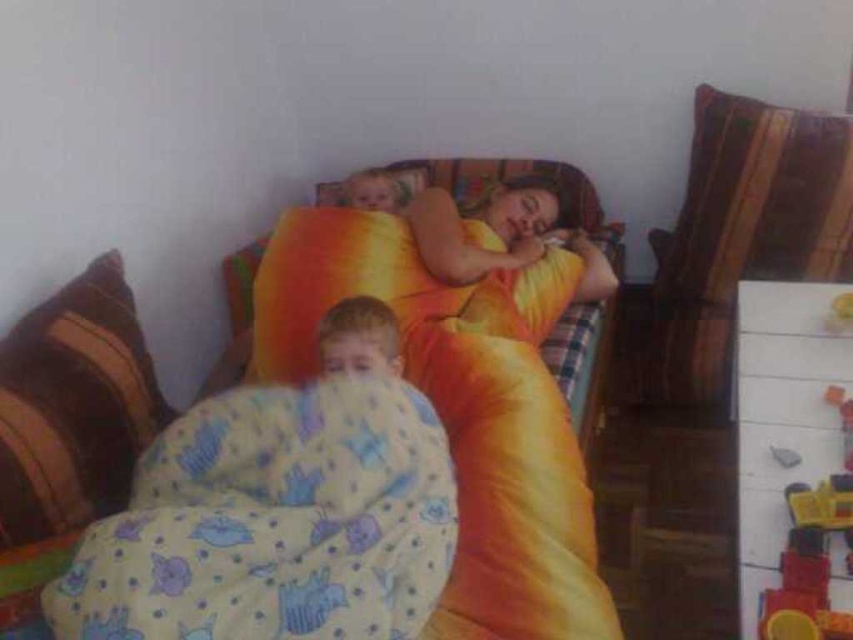
Is point (363, 333) positioned before point (850, 300)?

Yes, point (363, 333) is in front of point (850, 300).

Can you confirm if smooth yellow blanket at lower center is positioned below yellow plastic toy at upper right?

Yes.

Measure the distance between smooth yellow blanket at lower center and camera.

A distance of 4.78 feet exists between smooth yellow blanket at lower center and camera.

Where is `smooth yellow blanket at lower center`? smooth yellow blanket at lower center is located at coordinates (358, 337).

Between striped fabric pillow at upper right and striped fabric pillow at left, which one has more height?

striped fabric pillow at upper right

Locate an element on the screen. The height and width of the screenshot is (640, 853). striped fabric pillow at upper right is located at coordinates (753, 205).

Where is `striped fabric pillow at upper right`? This screenshot has height=640, width=853. striped fabric pillow at upper right is located at coordinates (753, 205).

Where is `striped fabric pillow at upper right`? This screenshot has width=853, height=640. striped fabric pillow at upper right is located at coordinates (753, 205).

Who is higher up, smooth yellow blanket at lower center or smooth yellow pillow at upper center?

smooth yellow pillow at upper center is higher up.

Looking at this image, is smooth yellow blanket at lower center to the right of smooth yellow pillow at upper center from the viewer's perspective?

In fact, smooth yellow blanket at lower center is to the left of smooth yellow pillow at upper center.

Which is behind, point (335, 349) or point (360, 186)?

Point (360, 186)

You are a GUI agent. You are given a task and a screenshot of the screen. Output one action in this format:
    pyautogui.click(x=<x>, y=<y>)
    Task: Click on the smooth yellow blanket at lower center
    
    Given the screenshot: What is the action you would take?
    pyautogui.click(x=358, y=337)